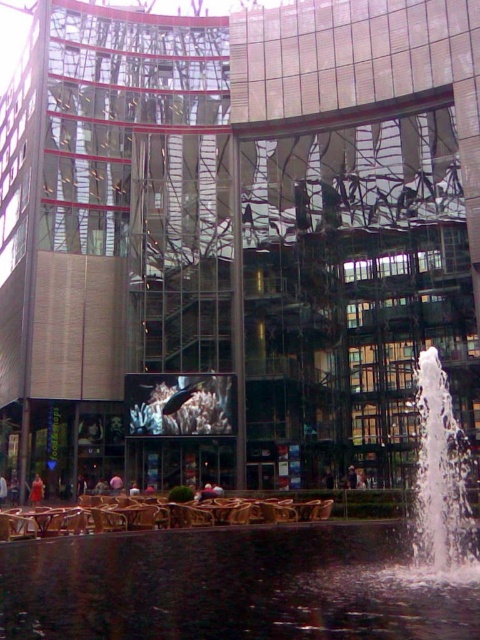
You are standing at the base of the glass building and want to locate two specific points marked on the water feature. The first point is at coordinates point (194,531), and the second is at point (98,515). From your vantage point, which point is closer to the building?

Point (194,531) is in front of point (98,515), so it is closer to the building.

You are standing in front of a modern glass building with a water feature. You want to take a photo of the black reflective water at lower center without including the building in the frame. Is the distance sufficient to step back and frame the water feature alone?

The black reflective water at lower center is 76.08 feet from the viewer. Since this distance allows enough space to step back and adjust the framing, you can move backward to exclude the building and capture only the water feature.

You are a visitor standing in front of the large glass building. You see the black reflective water at lower center and the brown wooden chairs at lower center. Which object is bigger in size?

The black reflective water at lower center is larger in size than the brown wooden chairs at lower center.